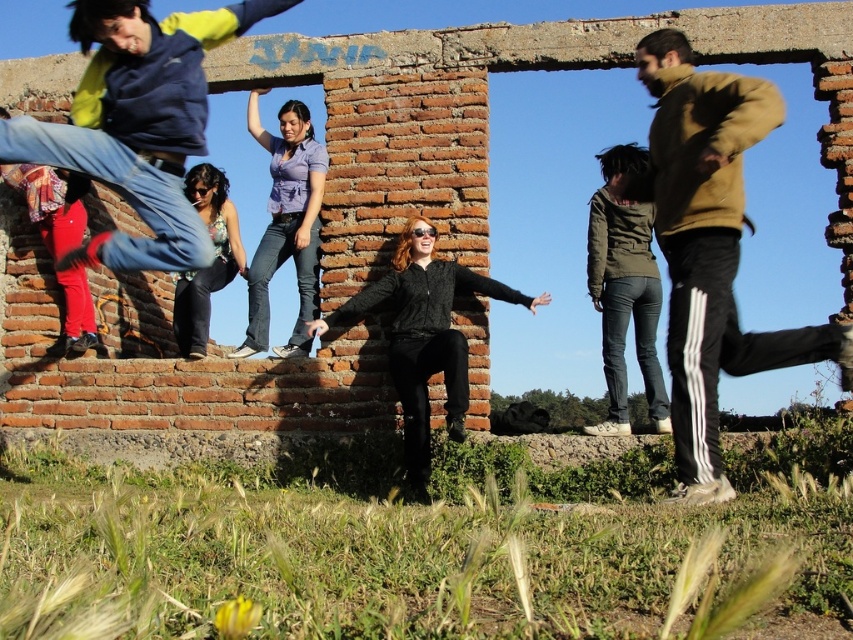
From the picture: Is blue denim jeans at upper left to the right of black matte sweater at center from the viewer's perspective?

No, blue denim jeans at upper left is not to the right of black matte sweater at center.

Does blue denim jeans at upper left have a greater height compared to black matte sweater at center?

Yes, blue denim jeans at upper left is taller than black matte sweater at center.

Is point (109, 128) in front of point (434, 289)?

Yes, point (109, 128) is closer to viewer.

Where is `blue denim jeans at upper left`? The width and height of the screenshot is (853, 640). blue denim jeans at upper left is located at coordinates (137, 122).

Between black matte sweater at center and floral blouse at center, which one has less height?

With less height is floral blouse at center.

Who is positioned more to the right, black matte sweater at center or floral blouse at center?

From the viewer's perspective, black matte sweater at center appears more on the right side.

Between point (401, 268) and point (234, 211), which one is positioned in front?

Positioned in front is point (401, 268).

Locate an element on the screen. black matte sweater at center is located at coordinates (422, 336).

Can you confirm if denim jeans at center is smaller than floral blouse at center?

Incorrect, denim jeans at center is not smaller in size than floral blouse at center.

Who is more forward, (317, 202) or (228, 212)?

Point (317, 202) is more forward.

You are a GUI agent. You are given a task and a screenshot of the screen. Output one action in this format:
    pyautogui.click(x=<x>, y=<y>)
    Task: Click on the denim jeans at center
    
    Given the screenshot: What is the action you would take?
    pyautogui.click(x=286, y=225)